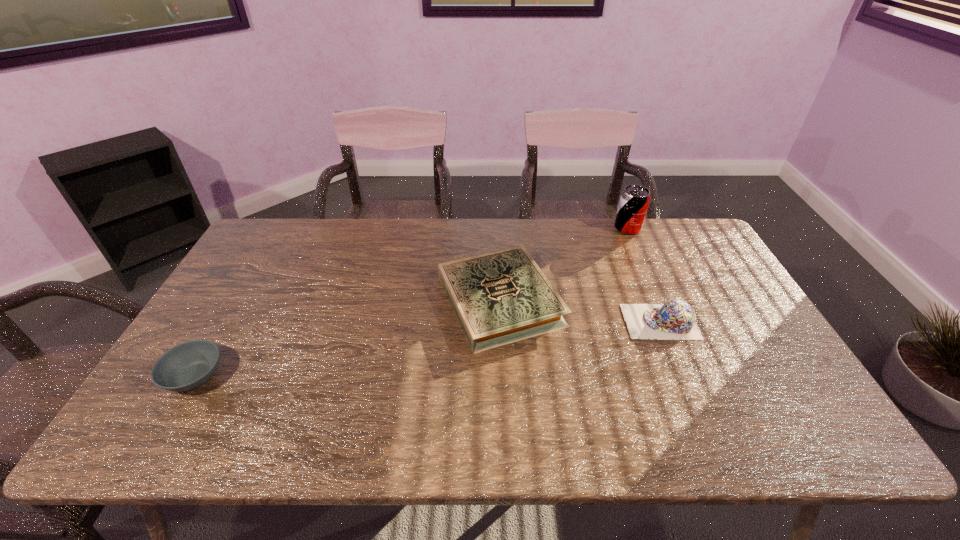
The image size is (960, 540). Identify the location of soda can. (634, 201).

Locate an element on the screen. The height and width of the screenshot is (540, 960). the tallest object is located at coordinates (634, 201).

Where is `cap`? This screenshot has width=960, height=540. cap is located at coordinates (675, 319).

Identify the location of hardback book. This screenshot has width=960, height=540. (501, 297).

This screenshot has width=960, height=540. In order to click on soup bowl in this screenshot , I will do `click(189, 365)`.

I want to click on vacant space situated 0.270m on the left of the soda can, so click(x=539, y=228).

Where is `vacant area situated 0.140m on the front, side, and top of the cap`? The image size is (960, 540). vacant area situated 0.140m on the front, side, and top of the cap is located at coordinates (574, 322).

Locate an element on the screen. vacant area situated 0.130m on the front, side, and top of the cap is located at coordinates (578, 322).

The image size is (960, 540). In order to click on vacant space located 0.360m on the front, side, and top of the cap in this screenshot , I will do `click(495, 322)`.

Identify the location of vacant area located on the right of the third object from right to left. (619, 301).